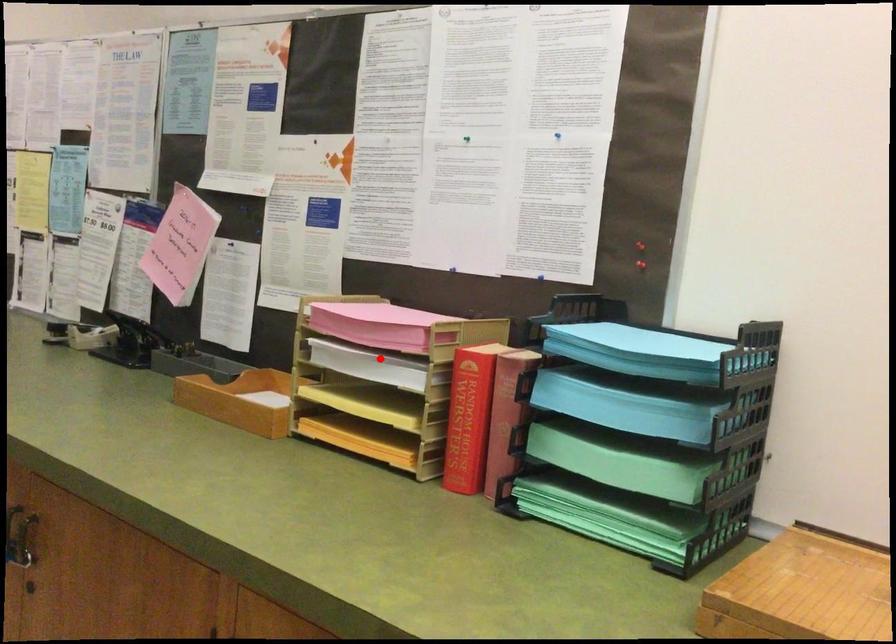
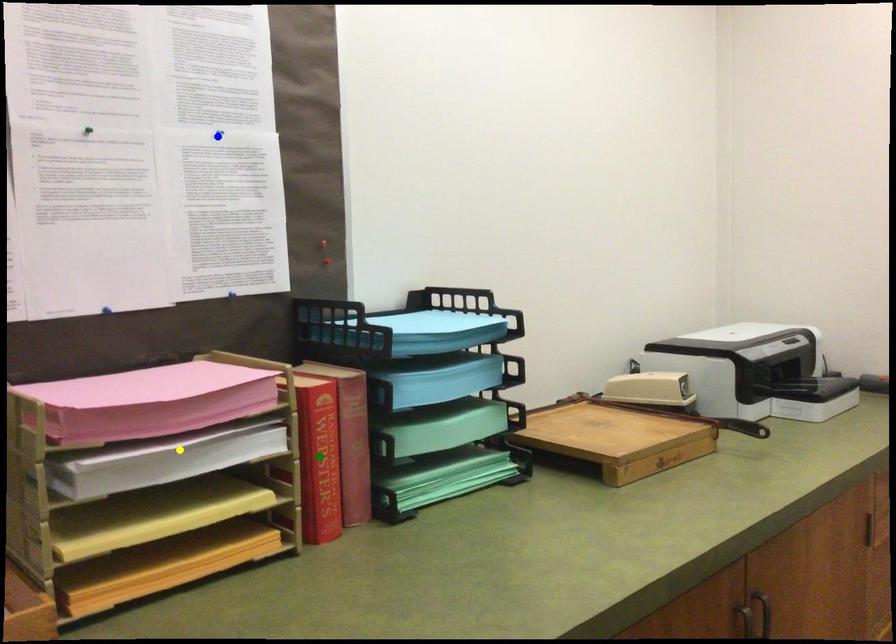
Question: I am providing you with two images of the same scene from different viewpoints. A red point is marked on the first image. You are given multiple points on the second image. Which spot in image 2 lines up with the point in image 1?

Choices:
 (A) blue point
 (B) yellow point
 (C) green point

Answer: (B)